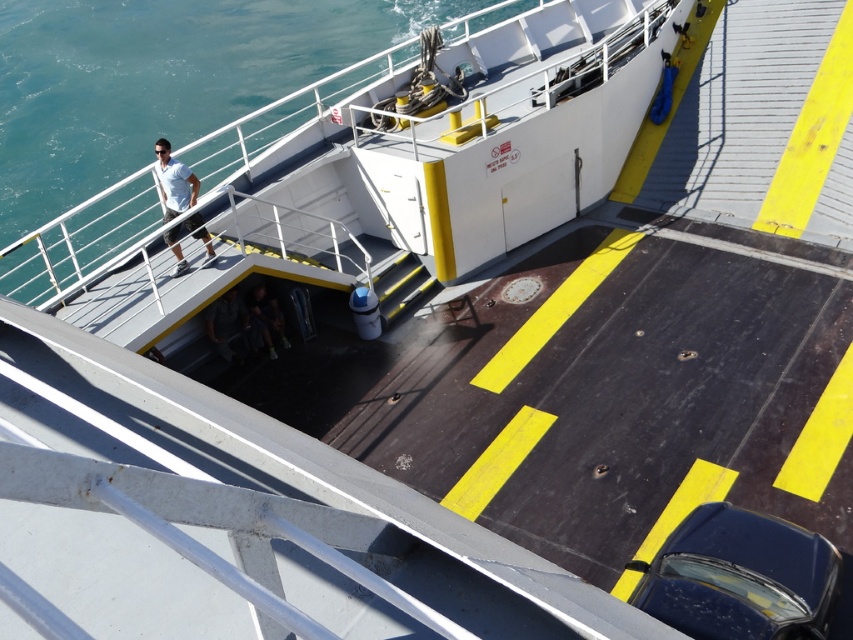
Who is more distant from viewer, (165,193) or (209,339)?

Positioned behind is point (209,339).

Can you confirm if matte white shirt at upper left is thinner than dark gray fabric jacket at lower center?

No, matte white shirt at upper left is not thinner than dark gray fabric jacket at lower center.

Does point (163, 218) lie behind point (227, 317)?

That is False.

The height and width of the screenshot is (640, 853). I want to click on matte white shirt at upper left, so click(x=173, y=180).

Is dark gray fabric jacket at lower center thinner than dark brown leather jacket at lower center?

Yes, dark gray fabric jacket at lower center is thinner than dark brown leather jacket at lower center.

Can you confirm if dark gray fabric jacket at lower center is positioned to the left of dark brown leather jacket at lower center?

Indeed, dark gray fabric jacket at lower center is positioned on the left side of dark brown leather jacket at lower center.

Image resolution: width=853 pixels, height=640 pixels. I want to click on dark gray fabric jacket at lower center, so click(x=225, y=323).

Does glossy dark blue car at lower right appear under dark brown leather jacket at lower center?

Yes, glossy dark blue car at lower right is below dark brown leather jacket at lower center.

Which is behind, point (828, 572) or point (258, 323)?

The point (258, 323) is behind.

Is point (827, 570) positioned behind point (283, 324)?

No, it is in front of (283, 324).

Where is `glossy dark blue car at lower right`? The height and width of the screenshot is (640, 853). glossy dark blue car at lower right is located at coordinates (x=740, y=577).